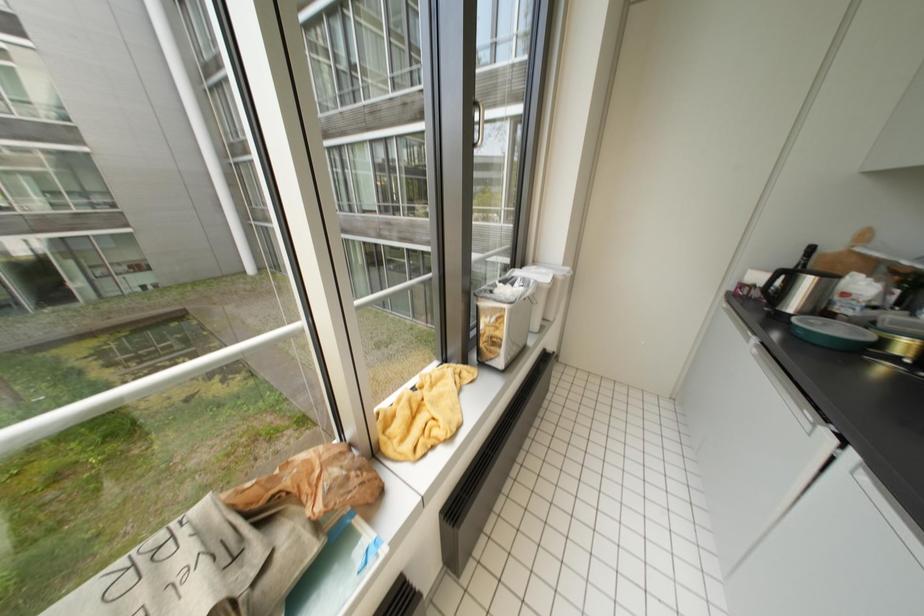
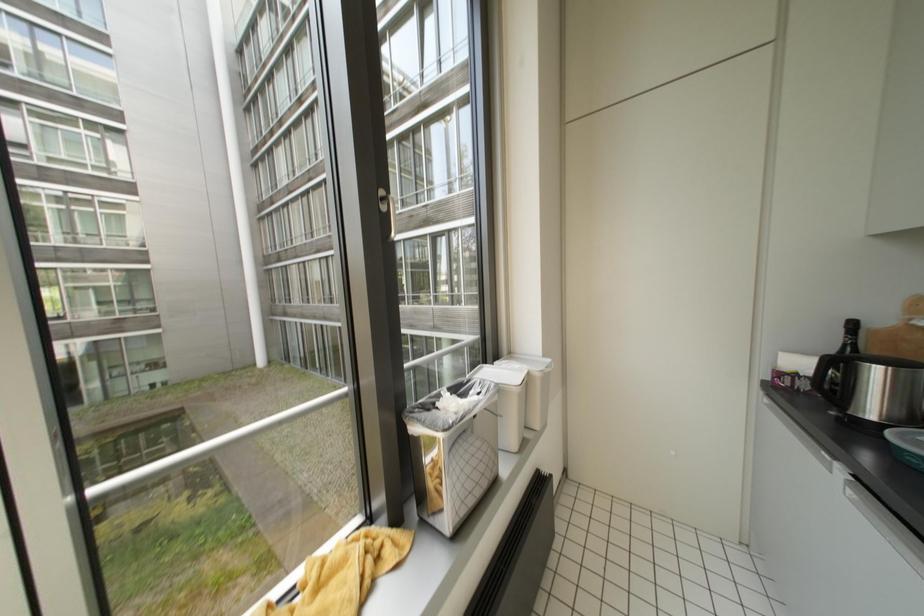
Which direction would the cameraman need to move to produce the second image?

The movement direction of the cameraman is right, forward.